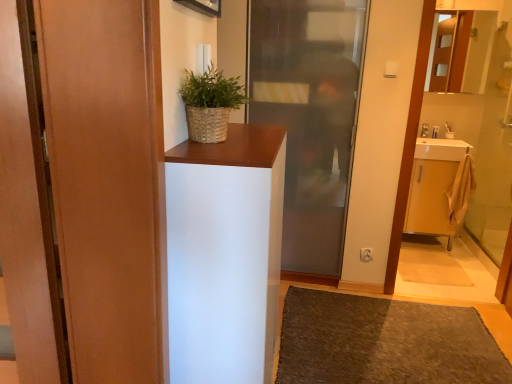
Question: Is matte wood door at left, the 1th door from the front, taller than transparent glass door at center, which is counted as the 2th door, starting from the front?

Choices:
 (A) no
 (B) yes

Answer: (A)

Question: Is matte wood door at left, the 2th door from the right, placed right next to transparent glass door at center, placed as the 2th door when sorted from left to right?

Choices:
 (A) yes
 (B) no

Answer: (B)

Question: Does matte wood door at left, the 1th door from the front, have a lesser height compared to transparent glass door at center, placed as the 2th door when sorted from left to right?

Choices:
 (A) yes
 (B) no

Answer: (A)

Question: From the image's perspective, is matte wood door at left, marked as the first door in a left-to-right arrangement, under transparent glass door at center, placed as the 2th door when sorted from left to right?

Choices:
 (A) no
 (B) yes

Answer: (B)

Question: Is matte wood door at left, the 1th door from the front, positioned behind transparent glass door at center, placed as the 2th door when sorted from left to right?

Choices:
 (A) yes
 (B) no

Answer: (B)

Question: Is matte wood door at left, arranged as the 2th door when viewed from the back, closer to the viewer compared to transparent glass door at center, which is the 1th door in back-to-front order?

Choices:
 (A) yes
 (B) no

Answer: (A)

Question: Is white matte cabinet at center bigger than woven brown basket at upper center?

Choices:
 (A) no
 (B) yes

Answer: (B)

Question: Considering the relative positions of white matte cabinet at center and woven brown basket at upper center in the image provided, is white matte cabinet at center to the left of woven brown basket at upper center from the viewer's perspective?

Choices:
 (A) yes
 (B) no

Answer: (B)

Question: Does white matte cabinet at center come behind woven brown basket at upper center?

Choices:
 (A) yes
 (B) no

Answer: (B)

Question: Is white matte cabinet at center positioned with its back to woven brown basket at upper center?

Choices:
 (A) yes
 (B) no

Answer: (B)

Question: Considering the relative sizes of white matte cabinet at center and woven brown basket at upper center in the image provided, is white matte cabinet at center shorter than woven brown basket at upper center?

Choices:
 (A) no
 (B) yes

Answer: (A)

Question: Is white matte cabinet at center in front of woven brown basket at upper center?

Choices:
 (A) yes
 (B) no

Answer: (A)

Question: From the image's perspective, is white matte cabinet at center below brown textured rug at lower center?

Choices:
 (A) yes
 (B) no

Answer: (B)